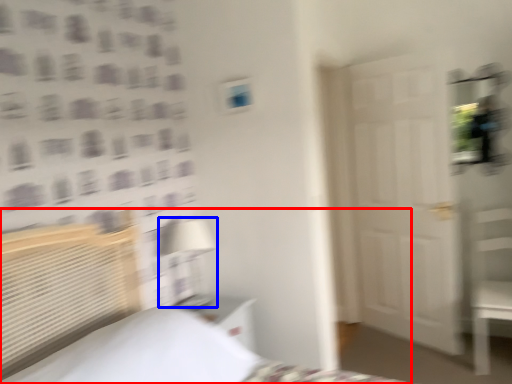
Question: Which object is further to the camera taking this photo, bed (highlighted by a red box) or table lamp (highlighted by a blue box)?

Choices:
 (A) bed
 (B) table lamp

Answer: (B)